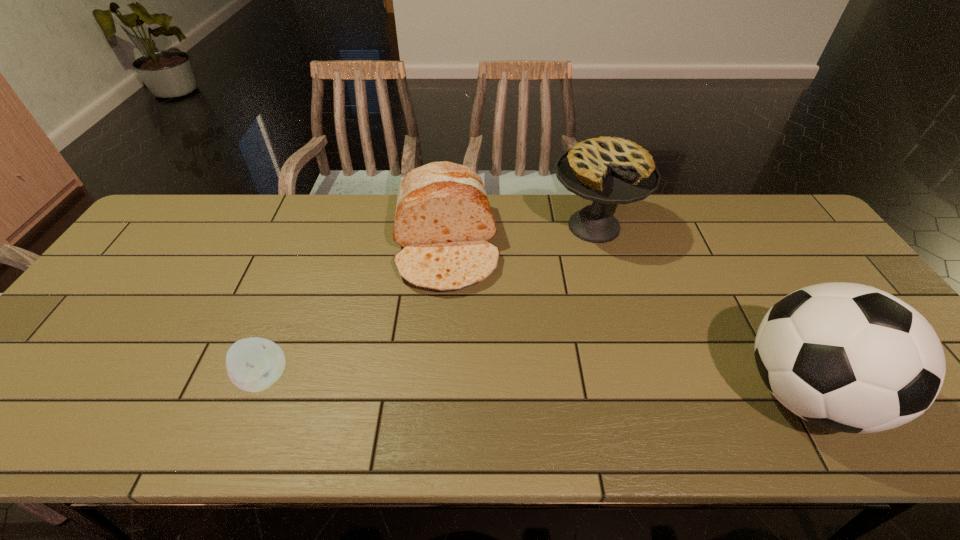
Where is `unoccupied area between the pie and the bread`? The image size is (960, 540). unoccupied area between the pie and the bread is located at coordinates (520, 236).

Where is `empty location between the second object from right to left and the second object from left to right`? empty location between the second object from right to left and the second object from left to right is located at coordinates (520, 236).

Where is `free space between the leftmost object and the rightmost object`? The height and width of the screenshot is (540, 960). free space between the leftmost object and the rightmost object is located at coordinates (534, 386).

The height and width of the screenshot is (540, 960). Identify the location of blank region between the leftmost object and the soccer ball. (534, 386).

The height and width of the screenshot is (540, 960). I want to click on empty space that is in between the second object from left to right and the rightmost object, so click(x=625, y=319).

I want to click on vacant area between the bread and the soccer ball, so click(x=625, y=319).

This screenshot has width=960, height=540. I want to click on vacant area between the shortest object and the soccer ball, so (x=534, y=386).

This screenshot has height=540, width=960. I want to click on the second closest object to the bread, so click(253, 364).

Identify which object is located as the nearest to the third object from left to right. Please provide its 2D coordinates. Your answer should be formatted as a tuple, i.e. [(x, y)], where the tuple contains the x and y coordinates of a point satisfying the conditions above.

[(443, 220)]

Locate an element on the screen. This screenshot has height=540, width=960. vacant space that satisfies the following two spatial constraints: 1. on the front side of the pie; 2. on the right side of the rightmost object is located at coordinates (640, 393).